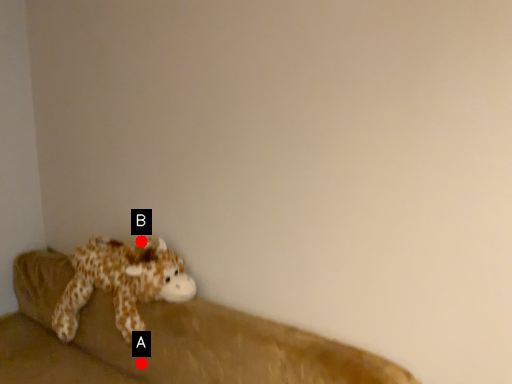
Question: Two points are circled on the image, labeled by A and B beside each circle. Which of the following is the closest to the observer?

Choices:
 (A) A is closer
 (B) B is closer

Answer: (A)